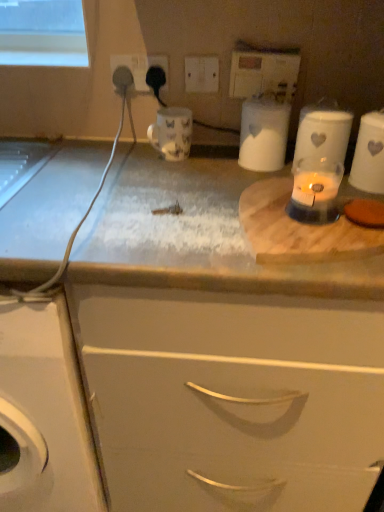
The width and height of the screenshot is (384, 512). In order to click on black plastic socket at upper center, acting as the first electric outlet starting from the left in this screenshot , I will do `click(141, 68)`.

Locate an element on the screen. This screenshot has width=384, height=512. black plastic socket at upper center, acting as the first electric outlet starting from the left is located at coordinates (141, 68).

From the image's perspective, is white matte container at upper center, which is the second appliance from left to right, over translucent glass candle at center?

Yes, from the image's perspective, white matte container at upper center, which is the second appliance from left to right, is on top of translucent glass candle at center.

Is white matte container at upper center, which is the second appliance from left to right, bigger than translucent glass candle at center?

Correct, white matte container at upper center, which is the second appliance from left to right, is larger in size than translucent glass candle at center.

Is white matte container at upper center, the second appliance in the right-to-left sequence, placed right next to translucent glass candle at center?

white matte container at upper center, the second appliance in the right-to-left sequence, and translucent glass candle at center are not in contact.

Is translucent glass candle at center a part of white matte container at upper center, which is the second appliance from left to right?

Definitely not — translucent glass candle at center is not inside white matte container at upper center, which is the second appliance from left to right.

Is white matte container at upper center, which is the second appliance from left to right, completely or partially inside black plastic socket at upper center, acting as the first electric outlet starting from the left?

No, white matte container at upper center, which is the second appliance from left to right, is located outside of black plastic socket at upper center, acting as the first electric outlet starting from the left.

From the image's perspective, is black plastic socket at upper center, the fourth electric outlet positioned from the right, below white matte container at upper center, which is the second appliance from left to right?

No, from the image's perspective, black plastic socket at upper center, the fourth electric outlet positioned from the right, is not beneath white matte container at upper center, which is the second appliance from left to right.

Starting from the black plastic socket at upper center, the fourth electric outlet positioned from the right, which appliance is the 2nd one in front? Please provide its 2D coordinates.

[(263, 134)]

Which is less distant, [123,64] or [279,130]?

The point [279,130] is more forward.

From a real-world perspective, which object stands above the other?

white plastic electric outlet at upper center, which is the fourth electric outlet in left-to-right order.

Considering the relative positions of white plastic switch at upper center, which is the 3th electric outlet in left-to-right order, and white plastic electric outlet at upper center, marked as the 1th electric outlet in a right-to-left arrangement, in the image provided, is white plastic switch at upper center, which is the 3th electric outlet in left-to-right order, to the right of white plastic electric outlet at upper center, marked as the 1th electric outlet in a right-to-left arrangement, from the viewer's perspective?

Incorrect, white plastic switch at upper center, which is the 3th electric outlet in left-to-right order, is not on the right side of white plastic electric outlet at upper center, marked as the 1th electric outlet in a right-to-left arrangement.

Is white plastic switch at upper center, which is the 3th electric outlet in left-to-right order, directly adjacent to white plastic electric outlet at upper center, which is the fourth electric outlet in left-to-right order?

No, white plastic switch at upper center, which is the 3th electric outlet in left-to-right order, is not making contact with white plastic electric outlet at upper center, which is the fourth electric outlet in left-to-right order.

Is translucent glass candle at center completely or partially outside of matte ceramic mug at center, which ranks as the 3th appliance in right-to-left order?

That's correct, translucent glass candle at center is outside of matte ceramic mug at center, which ranks as the 3th appliance in right-to-left order.

Considering the sizes of translucent glass candle at center and matte ceramic mug at center, which is counted as the first appliance, starting from the left, in the image, is translucent glass candle at center bigger or smaller than matte ceramic mug at center, which is counted as the first appliance, starting from the left,?

translucent glass candle at center is smaller than matte ceramic mug at center, which is counted as the first appliance, starting from the left.

From a real-world perspective, which object rests below the other?

matte ceramic mug at center, which is counted as the first appliance, starting from the left, is physically lower.

Which is behind, point (305, 207) or point (158, 113)?

The point (158, 113) is more distant.

Which of these two, white plastic switch at upper center, which is the second electric outlet from right to left, or white ceramic jar at upper right, placed as the 1th appliance when sorted from right to left, stands shorter?

white plastic switch at upper center, which is the second electric outlet from right to left.

Is white plastic switch at upper center, which is the 3th electric outlet in left-to-right order, next to white ceramic jar at upper right, acting as the third appliance starting from the left?

They are not placed beside each other.

Which is more to the right, white plastic switch at upper center, which is the 3th electric outlet in left-to-right order, or white ceramic jar at upper right, placed as the 1th appliance when sorted from right to left?

white ceramic jar at upper right, placed as the 1th appliance when sorted from right to left, is more to the right.

Which of these two, black plastic socket at upper center, acting as the first electric outlet starting from the left, or white plastic switch at upper center, which is the second electric outlet from right to left, is wider?

black plastic socket at upper center, acting as the first electric outlet starting from the left, is wider.

Who is bigger, black plastic socket at upper center, acting as the first electric outlet starting from the left, or white plastic switch at upper center, which is the second electric outlet from right to left?

black plastic socket at upper center, acting as the first electric outlet starting from the left, is bigger.

How distant is black plastic socket at upper center, acting as the first electric outlet starting from the left, from white plastic switch at upper center, which is the 3th electric outlet in left-to-right order?

A distance of 4.06 inches exists between black plastic socket at upper center, acting as the first electric outlet starting from the left, and white plastic switch at upper center, which is the 3th electric outlet in left-to-right order.

In the scene shown: Could you tell me if black plastic socket at upper center, acting as the first electric outlet starting from the left, is facing white plastic switch at upper center, which is the 3th electric outlet in left-to-right order?

No, black plastic socket at upper center, acting as the first electric outlet starting from the left, is not aimed at white plastic switch at upper center, which is the 3th electric outlet in left-to-right order.

Choose the correct answer: Is white ceramic jar at upper right, acting as the third appliance starting from the left, inside matte ceramic mug at center, which is counted as the first appliance, starting from the left, or outside it?

white ceramic jar at upper right, acting as the third appliance starting from the left, lies outside matte ceramic mug at center, which is counted as the first appliance, starting from the left.

Between white ceramic jar at upper right, placed as the 1th appliance when sorted from right to left, and matte ceramic mug at center, which ranks as the 3th appliance in right-to-left order, which one has larger width?

matte ceramic mug at center, which ranks as the 3th appliance in right-to-left order, is wider.

Based on the photo, which object is closer to the camera, white ceramic jar at upper right, acting as the third appliance starting from the left, or matte ceramic mug at center, which is counted as the first appliance, starting from the left?

Positioned in front is white ceramic jar at upper right, acting as the third appliance starting from the left.

Is white ceramic jar at upper right, placed as the 1th appliance when sorted from right to left, turned away from matte ceramic mug at center, which is counted as the first appliance, starting from the left?

white ceramic jar at upper right, placed as the 1th appliance when sorted from right to left, does not have its back to matte ceramic mug at center, which is counted as the first appliance, starting from the left.

Which appliance is the 2nd one when counting from the back of the translucent glass candle at center? Please provide its 2D coordinates.

[(263, 134)]

Find the location of a particular element. Image resolution: width=384 pixels, height=512 pixels. the 2nd appliance positioned below the black plastic socket at upper center, acting as the first electric outlet starting from the left (from the image's perspective) is located at coordinates (263, 134).

Based on their spatial positions, is white ceramic jar at upper right, acting as the third appliance starting from the left, or black plastic electric outlet at upper center, positioned as the second electric outlet in left-to-right order, further from white plastic switch at upper center, which is the second electric outlet from right to left?

The object further to white plastic switch at upper center, which is the second electric outlet from right to left, is white ceramic jar at upper right, acting as the third appliance starting from the left.

From the image, which object appears to be farther from black plastic electric outlet at upper center, positioned as the second electric outlet in left-to-right order, white plastic electric outlet at upper center, which is the fourth electric outlet in left-to-right order, or white plastic switch at upper center, which is the second electric outlet from right to left?

white plastic electric outlet at upper center, which is the fourth electric outlet in left-to-right order, lies further to black plastic electric outlet at upper center, positioned as the second electric outlet in left-to-right order, than the other object.

Looking at the image, which one is located further to black plastic electric outlet at upper center, positioned as the second electric outlet in left-to-right order, white plastic switch at upper center, which is the 3th electric outlet in left-to-right order, or matte ceramic mug at center, which is counted as the first appliance, starting from the left?

Based on the image, matte ceramic mug at center, which is counted as the first appliance, starting from the left, appears to be further to black plastic electric outlet at upper center, positioned as the second electric outlet in left-to-right order.

Estimate the real-world distances between objects in this image. Which object is closer to white plastic electric outlet at upper center, which is the fourth electric outlet in left-to-right order, white matte cabinet at center or black plastic socket at upper center, acting as the first electric outlet starting from the left?

Among the two, black plastic socket at upper center, acting as the first electric outlet starting from the left, is located nearer to white plastic electric outlet at upper center, which is the fourth electric outlet in left-to-right order.

When comparing their distances from white plastic electric outlet at upper center, which is the fourth electric outlet in left-to-right order, does translucent glass candle at center or white matte cabinet at center seem closer?

Among the two, translucent glass candle at center is located nearer to white plastic electric outlet at upper center, which is the fourth electric outlet in left-to-right order.

Looking at this image, which object lies nearer to the anchor point black plastic electric outlet at upper center, acting as the 3th electric outlet starting from the right, white plastic switch at upper center, which is the second electric outlet from right to left, or black plastic socket at upper center, the fourth electric outlet positioned from the right?

black plastic socket at upper center, the fourth electric outlet positioned from the right, is positioned closer to the anchor black plastic electric outlet at upper center, acting as the 3th electric outlet starting from the right.

When comparing their distances from black plastic socket at upper center, the fourth electric outlet positioned from the right, does white plastic switch at upper center, which is the 3th electric outlet in left-to-right order, or matte ceramic mug at center, which ranks as the 3th appliance in right-to-left order, seem further?

matte ceramic mug at center, which ranks as the 3th appliance in right-to-left order, lies further to black plastic socket at upper center, the fourth electric outlet positioned from the right, than the other object.

Based on their spatial positions, is white plastic switch at upper center, which is the second electric outlet from right to left, or white ceramic jar at upper right, acting as the third appliance starting from the left, closer to matte ceramic mug at center, which ranks as the 3th appliance in right-to-left order?

white plastic switch at upper center, which is the second electric outlet from right to left, is positioned closer to the anchor matte ceramic mug at center, which ranks as the 3th appliance in right-to-left order.

Where is `candle holder between black plastic electric outlet at upper center, positioned as the second electric outlet in left-to-right order, and white ceramic jar at upper right, acting as the third appliance starting from the left`? The height and width of the screenshot is (512, 384). candle holder between black plastic electric outlet at upper center, positioned as the second electric outlet in left-to-right order, and white ceramic jar at upper right, acting as the third appliance starting from the left is located at coordinates (315, 191).

In order to click on candle holder between white matte container at upper center, which is the second appliance from left to right, and white ceramic jar at upper right, placed as the 1th appliance when sorted from right to left in this screenshot , I will do `click(315, 191)`.

Identify the location of electric outlet situated between matte ceramic mug at center, which ranks as the 3th appliance in right-to-left order, and white plastic electric outlet at upper center, which is the fourth electric outlet in left-to-right order, from left to right. This screenshot has height=512, width=384. (201, 74).

Identify the location of candle holder between white plastic switch at upper center, which is the second electric outlet from right to left, and white matte cabinet at center vertically. Image resolution: width=384 pixels, height=512 pixels. (315, 191).